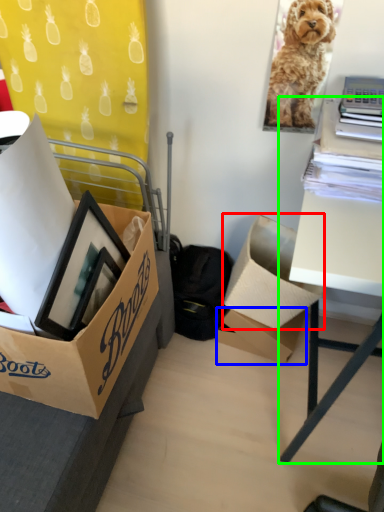
Question: Which object is the closest to the box (highlighted by a red box)? Choose among these: box (highlighted by a blue box) or table (highlighted by a green box).

Choices:
 (A) box
 (B) table

Answer: (A)